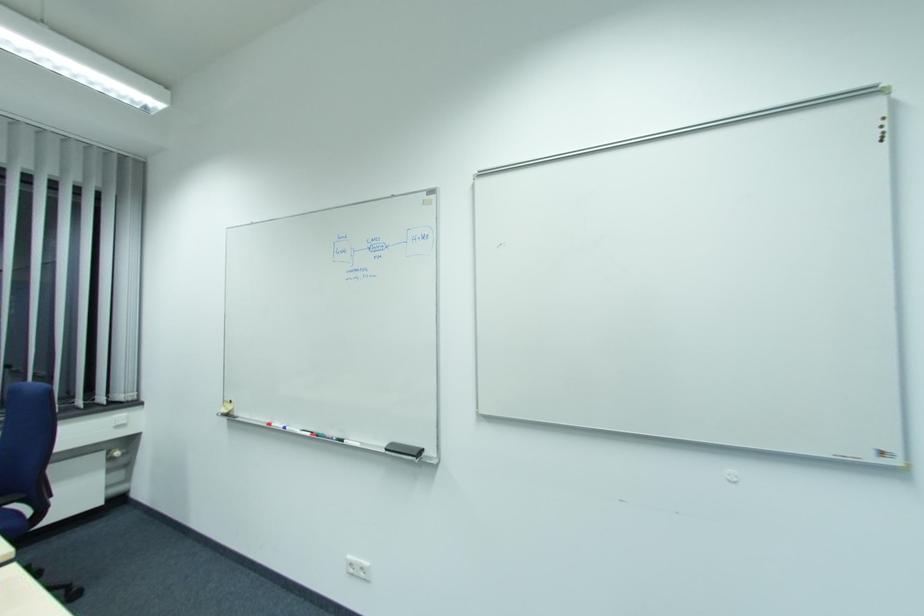
The height and width of the screenshot is (616, 924). Describe the element at coordinates (11, 522) in the screenshot. I see `the chair sitting surface` at that location.